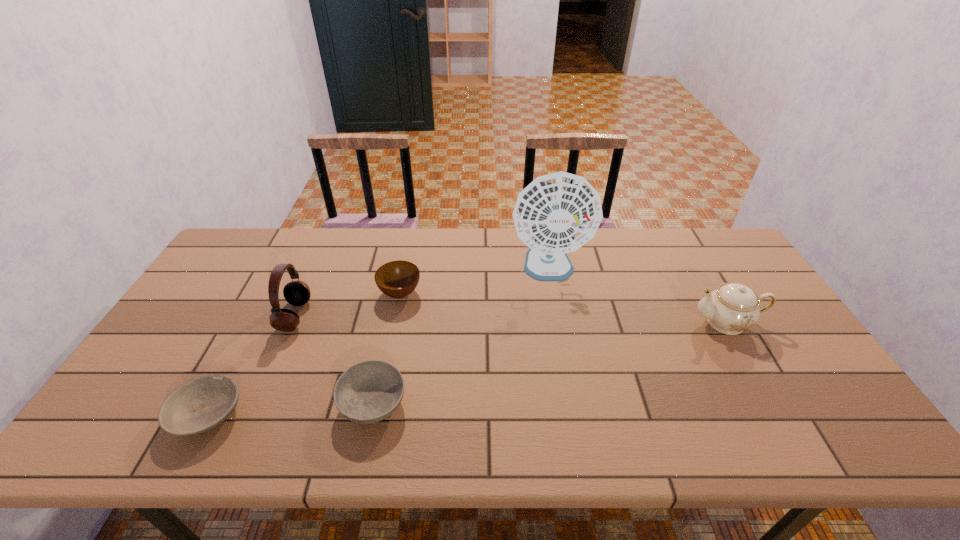
Find the location of a particular element. vacant region at the near edge of the desktop is located at coordinates (299, 453).

The image size is (960, 540). Identify the location of free space at the left edge of the desktop. (179, 325).

The width and height of the screenshot is (960, 540). In the image, there is a desktop. Identify the location of vacant space at the right edge. (776, 328).

Where is `free space at the near right corner`? Image resolution: width=960 pixels, height=540 pixels. free space at the near right corner is located at coordinates (797, 421).

Locate an element on the screen. vacant space that's between the chinaware and the farthest bowl is located at coordinates (564, 308).

Identify the location of free space between the fan and the rightmost object. The height and width of the screenshot is (540, 960). (637, 296).

The width and height of the screenshot is (960, 540). Find the location of `free space between the farthest bowl and the headset`. free space between the farthest bowl and the headset is located at coordinates pos(348,305).

Identify the location of vacant area that lies between the chinaware and the leftmost bowl. Image resolution: width=960 pixels, height=540 pixels. (468, 368).

Where is `free spot between the farthest bowl and the fan`? The height and width of the screenshot is (540, 960). free spot between the farthest bowl and the fan is located at coordinates (474, 281).

At what (x,y) coordinates should I click in order to perform the action: click on empty space that is in between the fifth shortest object and the shortest object. Please return your answer as a coordinate pair (x, y). This screenshot has width=960, height=540. Looking at the image, I should click on (251, 365).